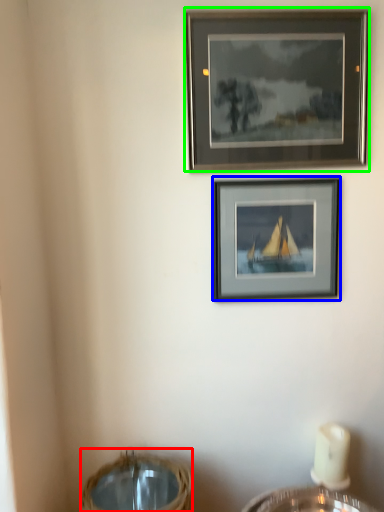
Question: Considering the real-world distances, which object is closest to basket (highlighted by a red box)? picture frame (highlighted by a blue box) or picture frame (highlighted by a green box).

Choices:
 (A) picture frame
 (B) picture frame

Answer: (A)